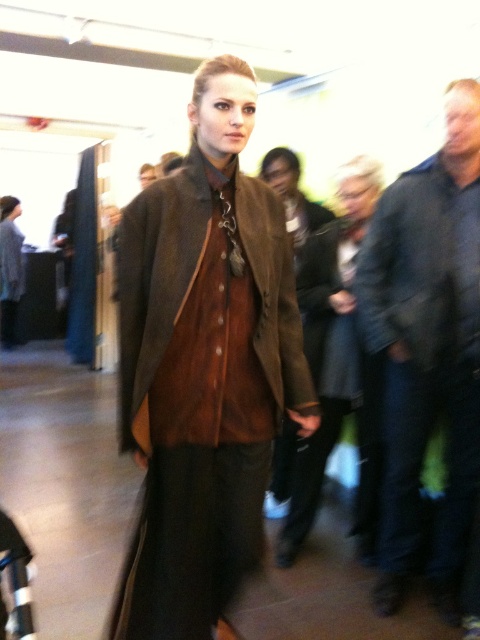
Is brown suede coat at center positioned in front of dark blue textured jacket at right?

Yes, it is.

Does brown suede coat at center have a greater width compared to dark blue textured jacket at right?

Indeed, brown suede coat at center has a greater width compared to dark blue textured jacket at right.

You are a GUI agent. You are given a task and a screenshot of the screen. Output one action in this format:
    pyautogui.click(x=<x>, y=<y>)
    Task: Click on the brown suede coat at center
    
    Given the screenshot: What is the action you would take?
    pyautogui.click(x=156, y=282)

Locate an element on the screen. Image resolution: width=480 pixels, height=640 pixels. brown suede coat at center is located at coordinates (156, 282).

Does dark blue denim jeans at right have a smaller size compared to dark blue textured jacket at right?

No, dark blue denim jeans at right is not smaller than dark blue textured jacket at right.

This screenshot has height=640, width=480. In order to click on dark blue denim jeans at right in this screenshot , I will do `click(428, 348)`.

Who is more distant from viewer, [360,296] or [415,353]?

Point [360,296]

Locate an element on the screen. dark blue denim jeans at right is located at coordinates (428, 348).

Can you confirm if dark blue denim jeans at right is positioned below brown suede coat at center?

Indeed, dark blue denim jeans at right is positioned under brown suede coat at center.

Between dark blue denim jeans at right and brown suede coat at center, which one appears on the right side from the viewer's perspective?

dark blue denim jeans at right

I want to click on dark blue denim jeans at right, so click(428, 348).